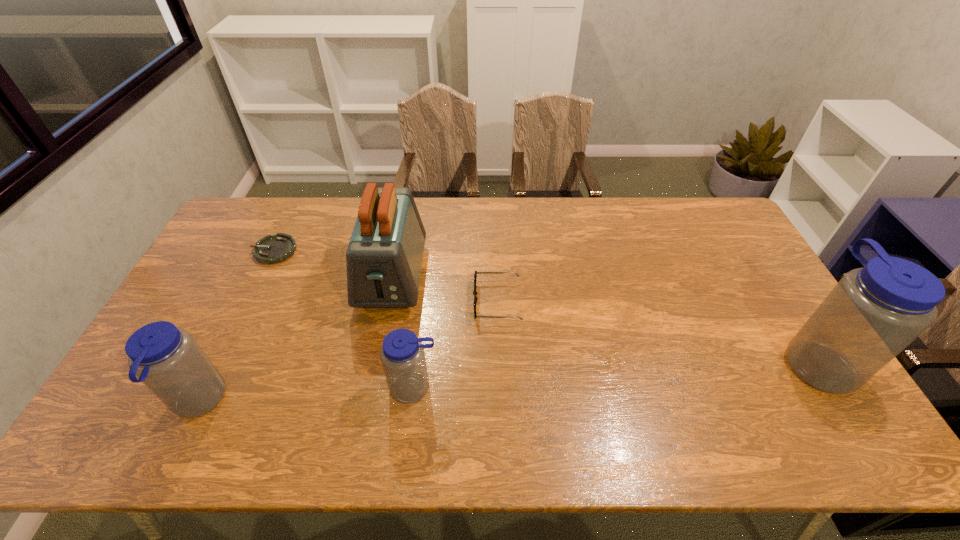
The height and width of the screenshot is (540, 960). I want to click on ashtray that is at the left edge, so click(271, 249).

Where is `object at the right edge`? object at the right edge is located at coordinates (873, 313).

Locate an element on the screen. This screenshot has height=540, width=960. object that is at the far left corner is located at coordinates (271, 249).

This screenshot has width=960, height=540. I want to click on object positioned at the near left corner, so click(x=167, y=359).

This screenshot has width=960, height=540. What are the coordinates of `object present at the near right corner` in the screenshot? It's located at (873, 313).

The height and width of the screenshot is (540, 960). What are the coordinates of `free space at the far edge of the desktop` in the screenshot? It's located at (334, 233).

Where is `free space at the near edge`? This screenshot has width=960, height=540. free space at the near edge is located at coordinates (574, 387).

What are the coordinates of `vacant region at the left edge of the desktop` in the screenshot? It's located at (203, 332).

At what (x,y) coordinates should I click in order to perform the action: click on free space at the right edge of the desktop. Please return your answer as a coordinate pair (x, y). Looking at the image, I should click on (765, 325).

Identify the location of free spot at the far left corner of the desktop. (275, 198).